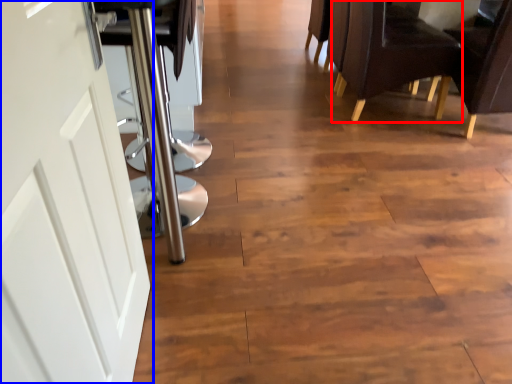
Question: Which point is further to the camera, chair (highlighted by a red box) or door (highlighted by a blue box)?

Choices:
 (A) chair
 (B) door

Answer: (A)